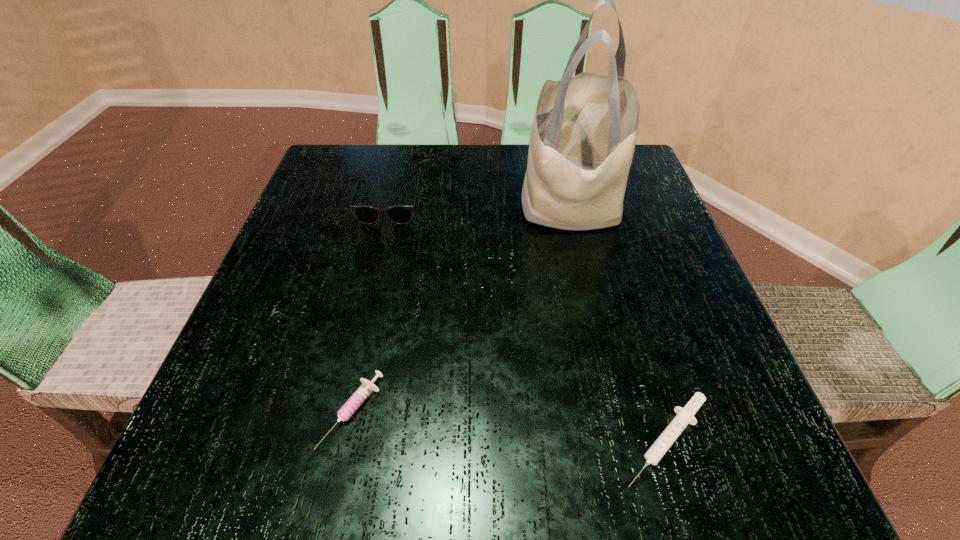
Identify the location of free area in between the tallest object and the sunglasses. (481, 201).

What are the coordinates of `object that stands as the second closest to the left syringe` in the screenshot? It's located at (583, 136).

Select which object appears as the closest to the left syringe. Please provide its 2D coordinates. Your answer should be formatted as a tuple, i.e. [(x, y)], where the tuple contains the x and y coordinates of a point satisfying the conditions above.

[(685, 416)]

Locate an element on the screen. The image size is (960, 540). vacant region that satisfies the following two spatial constraints: 1. at the front lenses of the left syringe; 2. on the right side of the sunglasses is located at coordinates (341, 412).

The height and width of the screenshot is (540, 960). In order to click on free spot that satisfies the following two spatial constraints: 1. on the front side of the right syringe; 2. on the right side of the tallest object in this screenshot , I will do (x=630, y=440).